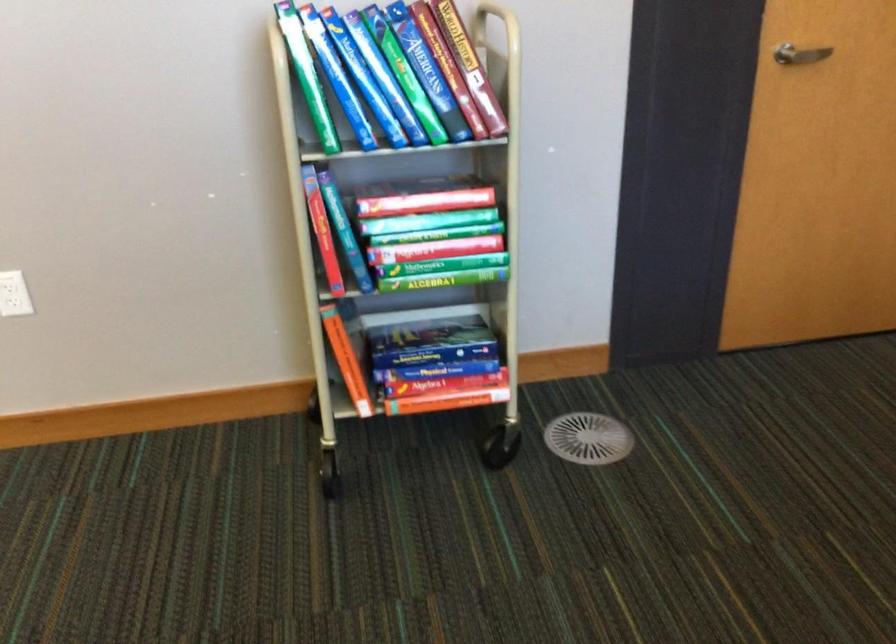
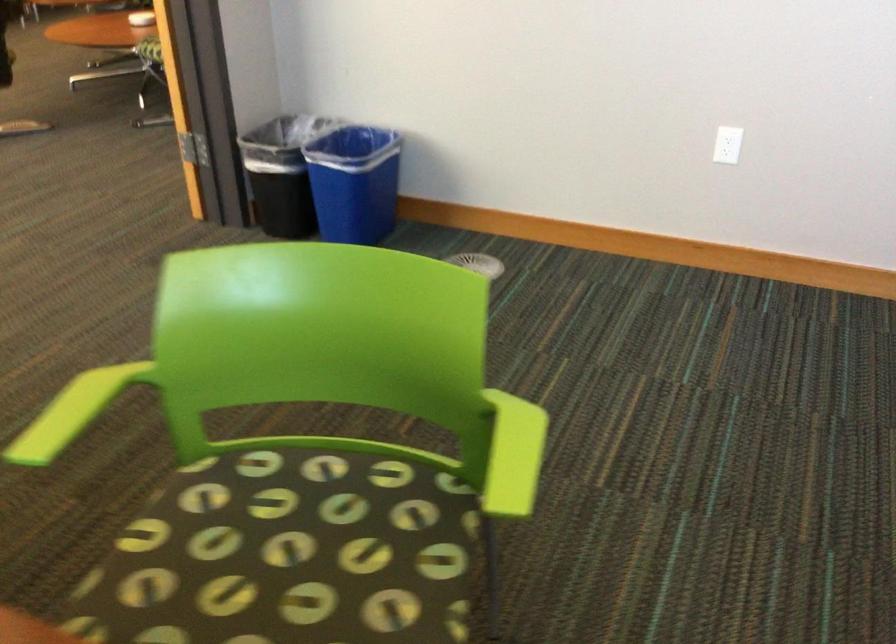
Question: Based on the continuous images, in which direction is the camera rotating? Reply with the corresponding letter.

Choices:
 (A) Left
 (B) Right
 (C) Up
 (D) Down

Answer: (A)